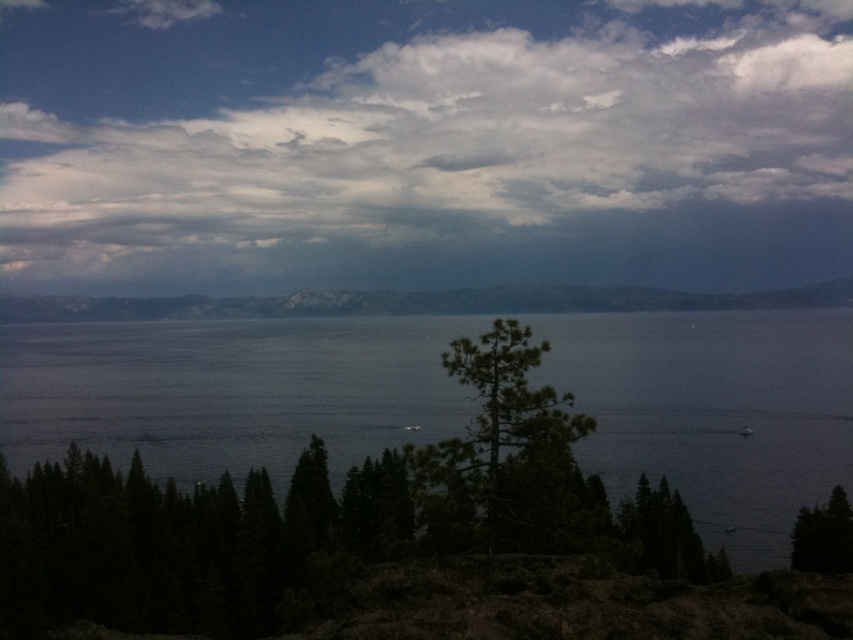
Does cloudy sky at upper center appear on the right side of green matte tree at lower right?

Incorrect, cloudy sky at upper center is not on the right side of green matte tree at lower right.

Can you confirm if cloudy sky at upper center is shorter than green matte tree at lower right?

In fact, cloudy sky at upper center may be taller than green matte tree at lower right.

What do you see at coordinates (422, 145) in the screenshot?
I see `cloudy sky at upper center` at bounding box center [422, 145].

The image size is (853, 640). What are the coordinates of `cloudy sky at upper center` in the screenshot? It's located at (422, 145).

Between dark blue water at center and green textured tree at center, which one appears on the right side from the viewer's perspective?

dark blue water at center is more to the right.

Does dark blue water at center have a greater width compared to green textured tree at center?

Yes.

Is point (727, 552) positioned after point (462, 476)?

Yes, it is behind point (462, 476).

Locate an element on the screen. The width and height of the screenshot is (853, 640). dark blue water at center is located at coordinates (229, 392).

Looking at this image, which of these two, dark blue water at center or gray matte horizon at center, stands taller?

Standing taller between the two is dark blue water at center.

Is dark blue water at center to the left of gray matte horizon at center from the viewer's perspective?

No, dark blue water at center is not to the left of gray matte horizon at center.

This screenshot has height=640, width=853. What are the coordinates of `dark blue water at center` in the screenshot? It's located at (229, 392).

I want to click on dark blue water at center, so click(x=229, y=392).